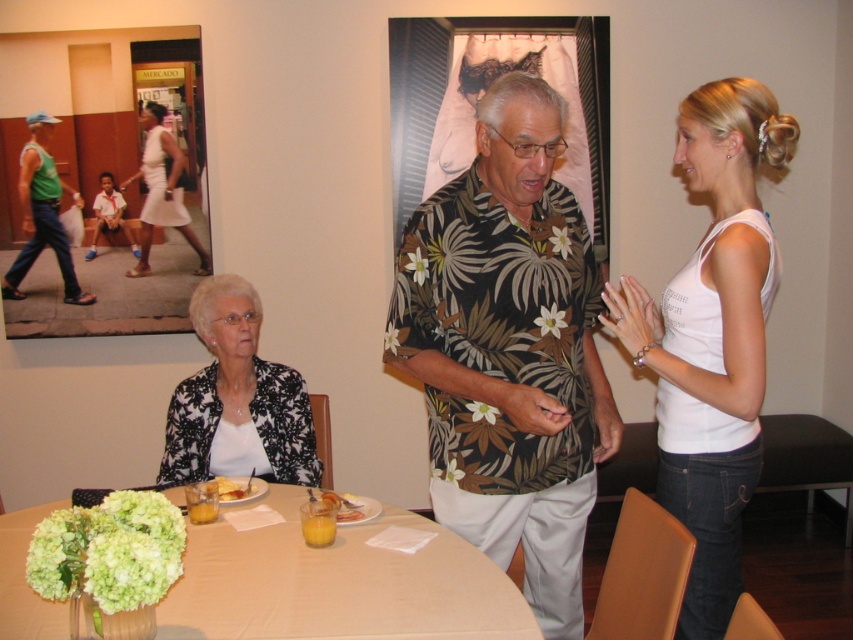
You are a guest at a dinner party and need to sit down. There are two chairs available next to the black printed fabric at lower left and the green fabric man at left. Which chair has more space for you to sit comfortably?

The chair next to the green fabric man at left has more space because the black printed fabric at lower left is narrower than the green fabric man at left.

You are a guest at this table and need to decide where to place your phone. The green fabric shirt at left and the yellow matte plate at center are already on the table. Which object takes up more space on the table?

The green fabric shirt at left is bigger than the yellow matte plate at center, so it takes up more space on the table.